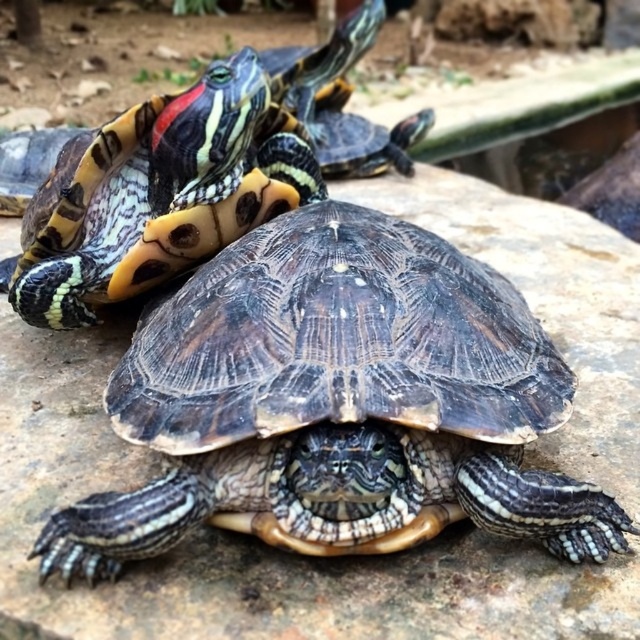
Is point (296, 131) closer to camera compared to point (296, 99)?

Yes, point (296, 131) is closer to viewer.

Who is higher up, shiny black shell at center or shiny black turtle at upper center?

shiny black turtle at upper center

What do you see at coordinates (157, 195) in the screenshot?
I see `shiny black shell at center` at bounding box center [157, 195].

Image resolution: width=640 pixels, height=640 pixels. Identify the location of shiny black shell at center. (157, 195).

Can you confirm if shiny brown tortoise at center is bigger than shiny black turtle at upper center?

Indeed, shiny brown tortoise at center has a larger size compared to shiny black turtle at upper center.

Is point (458, 336) positioned before point (317, 129)?

That is True.

Which is in front, point (138, 436) or point (364, 145)?

Point (138, 436) is more forward.

Find the location of a particular element. shiny brown tortoise at center is located at coordinates (337, 400).

Is shiny brown tortoise at center positioned in front of shiny black shell at center?

Yes, it is in front of shiny black shell at center.

Can you confirm if shiny brown tortoise at center is taller than shiny black shell at center?

Correct, shiny brown tortoise at center is much taller as shiny black shell at center.

Does point (582, 545) come farther from viewer compared to point (275, 188)?

That is False.

Identify the location of shiny brown tortoise at center. (337, 400).